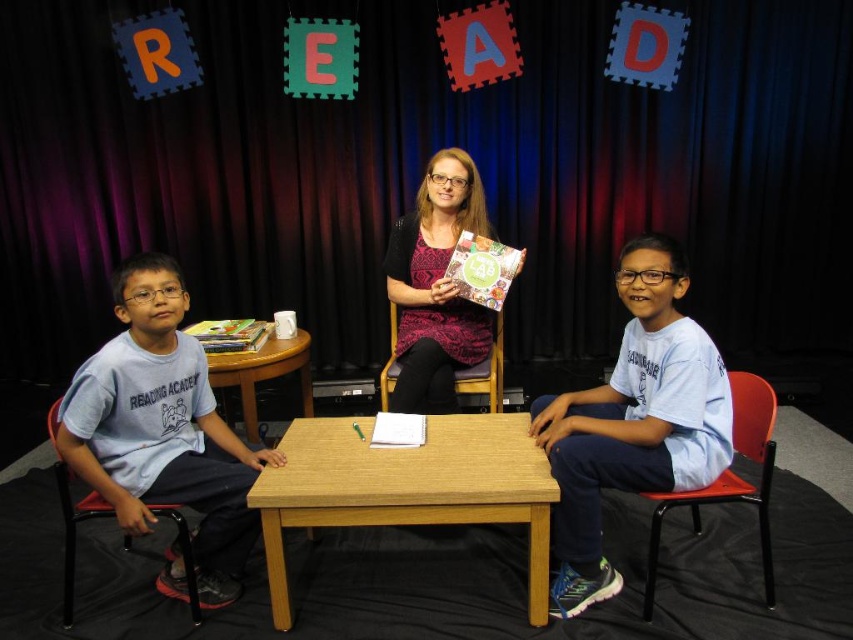
Between light blue t-shirt at center and wooden table at center, which one is positioned lower?

light blue t-shirt at center is lower down.

Who is taller, light blue t-shirt at center or wooden table at center?

light blue t-shirt at center is taller.

Is point (624, 292) closer to viewer compared to point (265, 349)?

Yes, point (624, 292) is in front of point (265, 349).

The width and height of the screenshot is (853, 640). I want to click on light blue t-shirt at center, so click(633, 420).

Who is taller, black curtain at upper center or wooden chair at center?

black curtain at upper center

Does point (735, 61) come farther from viewer compared to point (473, 372)?

Yes, it is.

Describe the element at coordinates (422, 172) in the screenshot. I see `black curtain at upper center` at that location.

Identify the location of black curtain at upper center. (422, 172).

Does point (654, 528) lie in front of point (492, 360)?

Yes, point (654, 528) is closer to viewer.

Locate an element on the screen. The image size is (853, 640). black plastic chair at lower right is located at coordinates (728, 480).

Find the location of a particular element. The height and width of the screenshot is (640, 853). black plastic chair at lower right is located at coordinates (728, 480).